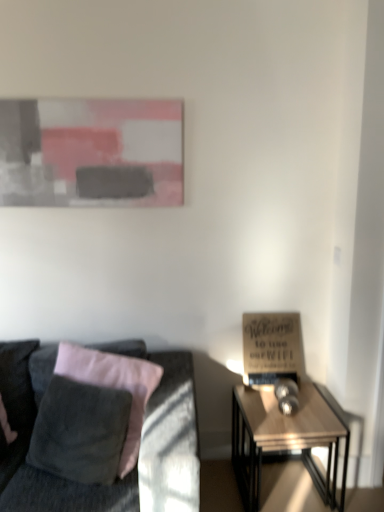
At what (x,y) coordinates should I click in order to perform the action: click on free spot above wooden glossy table at right (from a real-world perspective). Please return your answer as a coordinate pair (x, y). Image resolution: width=384 pixels, height=512 pixels. Looking at the image, I should click on (292, 413).